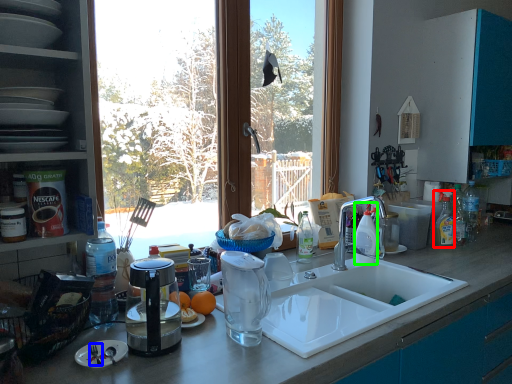
Question: Which is nearer to the cleaning product (highlighted by a red box)? silverware (highlighted by a blue box) or bottle (highlighted by a green box).

Choices:
 (A) silverware
 (B) bottle

Answer: (B)